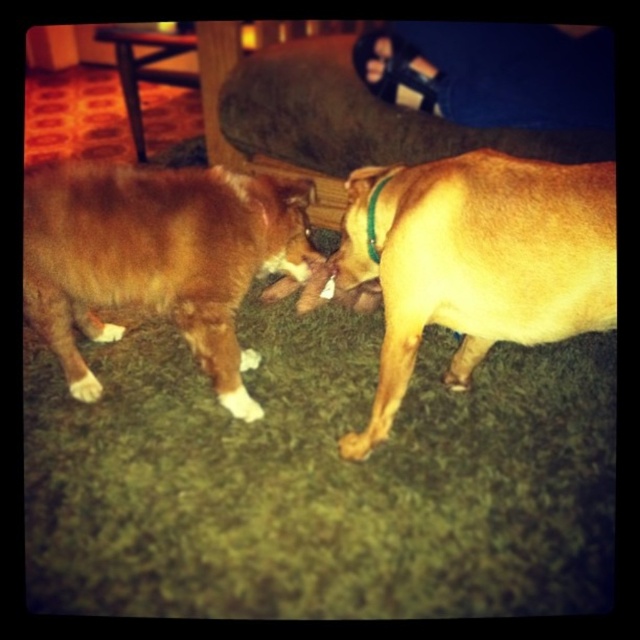
You are a dog owner who wants to put a green fabric neckband at center on your brown furry dog at center. Based on the scene, will the neckband fit around the dog if you place it where it currently is?

The brown furry dog at center is below the green fabric neckband at center, so the neckband is not positioned around the dog. To determine if it fits, you would need to adjust the neckband to the dog properly.

You are a dog owner who wants to put a green fabric neckband at center on your brown furry dog at center. Can you do this without moving the neckband from its current position?

The brown furry dog at center is positioned on the left side of green fabric neckband at center, so you can put the green fabric neckband at center on the brown furry dog at center without moving the neckband from its current position because the dog is already near it.

You are a dog trainer observing two dogs in a room. You see the brown furry dog at center and the brown fur paw at lower center. Which one is bigger?

The brown furry dog at center is larger in size than the brown fur paw at lower center.